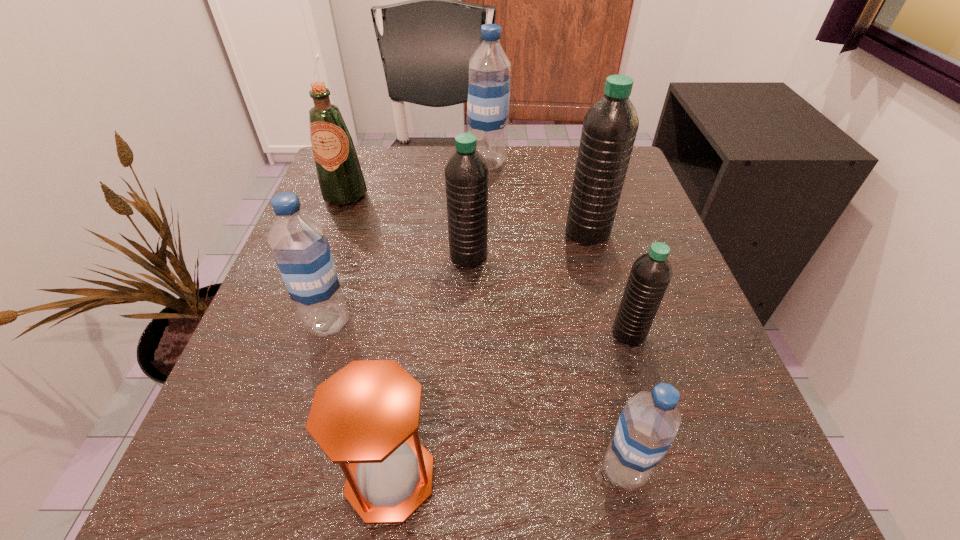
Find the location of a particular element. Image resolution: width=960 pixels, height=540 pixels. free space between the nearest black water bottle and the leftmost black water bottle is located at coordinates (549, 295).

You are a GUI agent. You are given a task and a screenshot of the screen. Output one action in this format:
    pyautogui.click(x=<x>, y=<y>)
    Task: Click on the vacant area between the nearest black water bottle and the second blue water bottle from left to right
    This screenshot has width=960, height=540.
    Given the screenshot: What is the action you would take?
    pyautogui.click(x=558, y=248)

Where is `vacant area that lies between the farthest blue water bottle and the green olive oil`? vacant area that lies between the farthest blue water bottle and the green olive oil is located at coordinates (416, 179).

Find the location of a particular element. free space between the smallest blue water bottle and the green olive oil is located at coordinates (485, 332).

Find the location of a particular element. The height and width of the screenshot is (540, 960). free space between the leftmost blue water bottle and the biggest black water bottle is located at coordinates (458, 278).

This screenshot has width=960, height=540. In order to click on free spot between the nearest black water bottle and the rightmost blue water bottle in this screenshot , I will do `click(626, 402)`.

Locate an element on the screen. This screenshot has width=960, height=540. vacant area that lies between the biggest black water bottle and the sixth object from right to left is located at coordinates (489, 355).

Find the location of a particular element. This screenshot has width=960, height=540. vacant area that lies between the leftmost blue water bottle and the nearest black water bottle is located at coordinates (478, 328).

The height and width of the screenshot is (540, 960). What are the coordinates of `object that is the fourth nearest to the smallest black water bottle` in the screenshot? It's located at (367, 414).

The height and width of the screenshot is (540, 960). I want to click on object that can be found as the third closest to the leftmost black water bottle, so click(x=340, y=177).